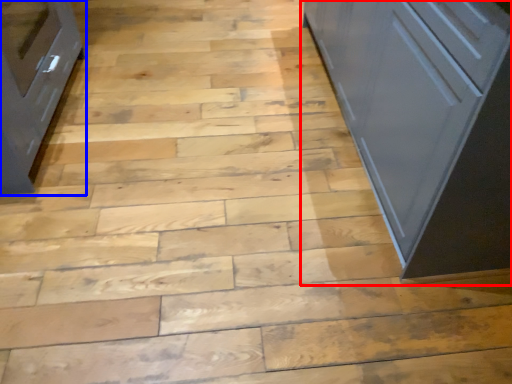
Question: Which point is closer to the camera, cupboard (highlighted by a red box) or cabinetry (highlighted by a blue box)?

Choices:
 (A) cupboard
 (B) cabinetry

Answer: (A)